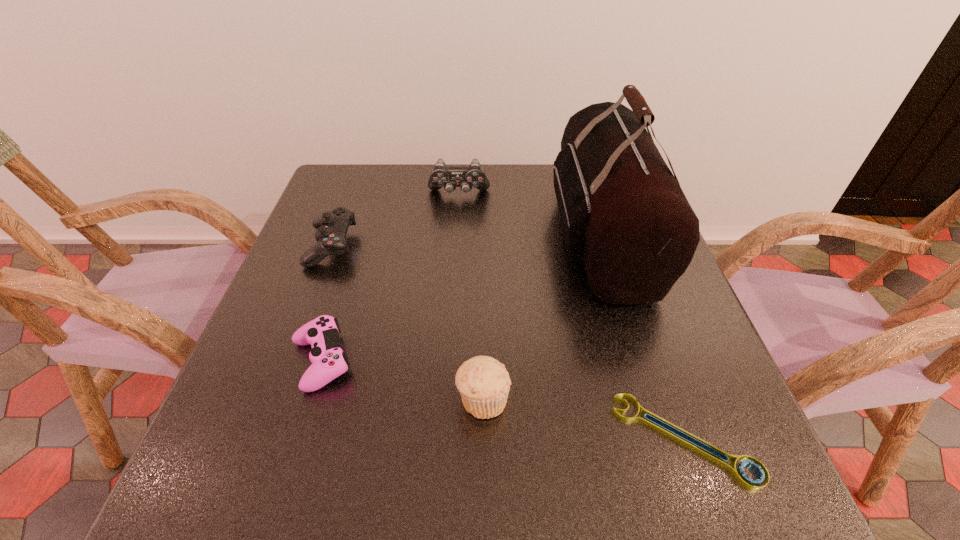
Locate an element on the screen. The height and width of the screenshot is (540, 960). duffel bag is located at coordinates (624, 216).

The height and width of the screenshot is (540, 960). I want to click on the tallest control, so (449, 177).

Find the location of `the rightmost control`. the rightmost control is located at coordinates (449, 177).

Where is `muffin`? The width and height of the screenshot is (960, 540). muffin is located at coordinates (483, 382).

Where is `the third shortest object`? the third shortest object is located at coordinates (332, 226).

The image size is (960, 540). I want to click on the second farthest control, so click(332, 226).

Where is `the shortest control`? This screenshot has width=960, height=540. the shortest control is located at coordinates (328, 360).

The width and height of the screenshot is (960, 540). What are the coordinates of `the fifth tallest object` in the screenshot? It's located at (328, 360).

Find the location of a particular element. the shortest object is located at coordinates (739, 474).

Where is `blank space located 0.320m on the front pocket of the duffel bag`? This screenshot has width=960, height=540. blank space located 0.320m on the front pocket of the duffel bag is located at coordinates pos(424,236).